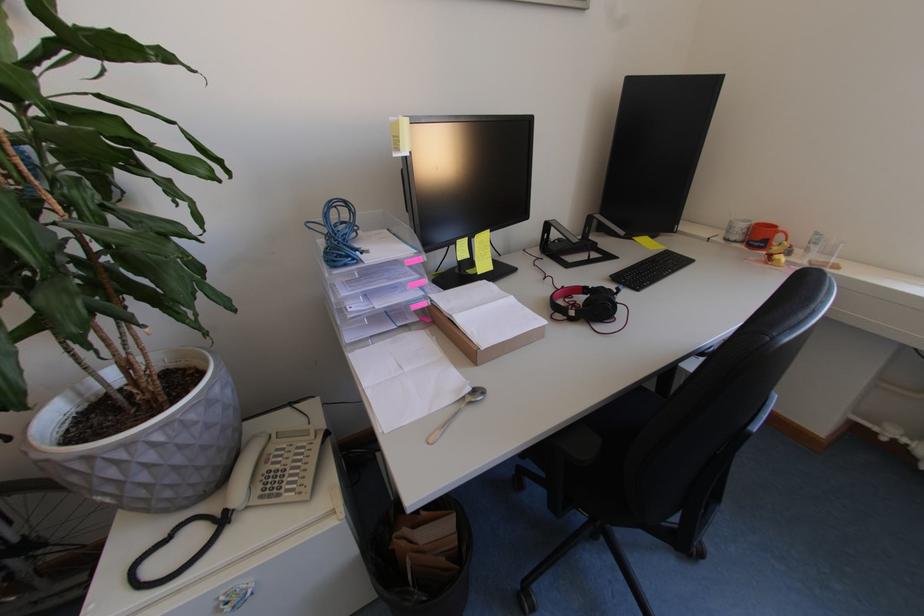
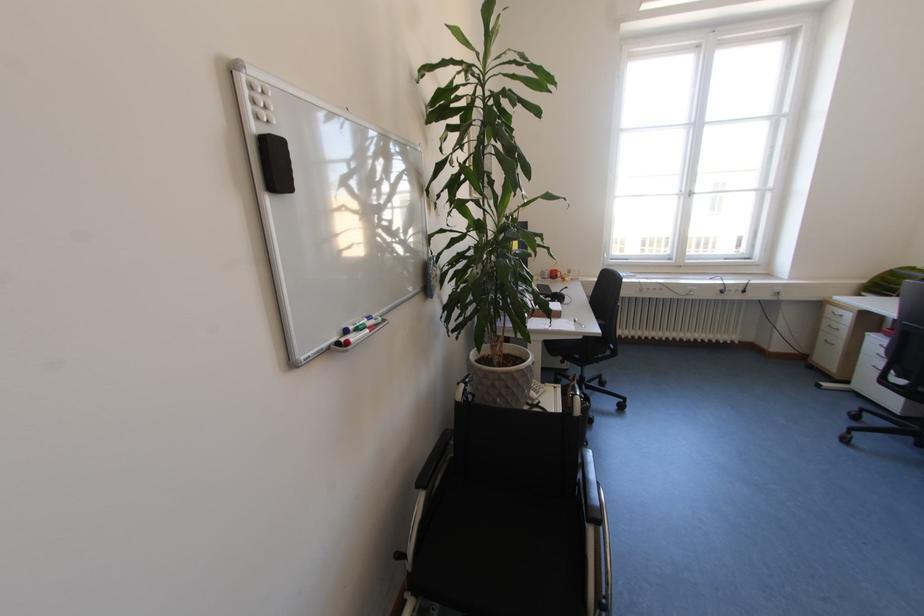
The point at (742, 240) is marked in the first image. Where is the corresponding point in the second image?

(553, 278)